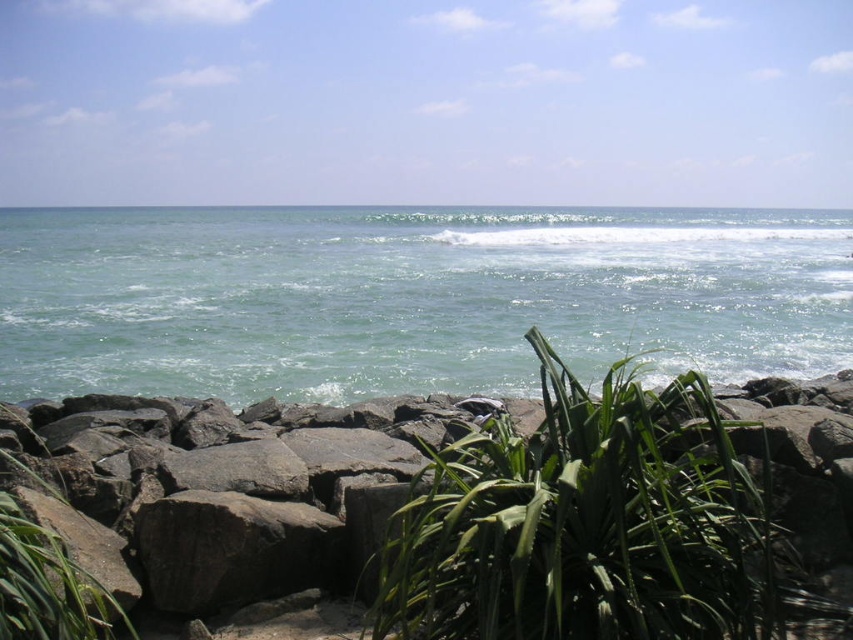
Question: Which point is farther from the camera taking this photo?

Choices:
 (A) pos(711,422)
 (B) pos(65,307)

Answer: (B)

Question: Is greenish-blue water at upper center below green leafy plant at center?

Choices:
 (A) yes
 (B) no

Answer: (B)

Question: Is greenish-blue water at upper center wider than green leafy plant at center?

Choices:
 (A) no
 (B) yes

Answer: (B)

Question: Does greenish-blue water at upper center have a lesser width compared to green leafy plant at center?

Choices:
 (A) no
 (B) yes

Answer: (A)